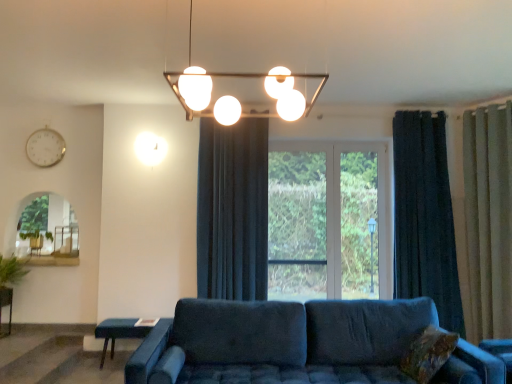
Question: From the image's perspective, is blue fabric table at lower left, the 2th table when ordered from left to right, positioned above or below beige fabric curtain at right, the third curtain when ordered from left to right?

Choices:
 (A) below
 (B) above

Answer: (A)

Question: Relative to beige fabric curtain at right, the third curtain when ordered from left to right, is blue fabric table at lower left, the 2th table when ordered from left to right, in front or behind?

Choices:
 (A) behind
 (B) front

Answer: (A)

Question: Which of these objects is positioned closest to the green leafy plant at left?

Choices:
 (A) dark blue velvet curtain at right, which is the 2th curtain from right to left
 (B) white metallic clock at upper left
 (C) dark blue velvet curtain at center, which appears as the 3th curtain when viewed from the right
 (D) metallic pendant light at upper center
 (E) brown textured pillow at lower right

Answer: (B)

Question: Which of these objects is positioned closest to the velvet blue couch at center?

Choices:
 (A) beige fabric curtain at right, the third curtain when ordered from left to right
 (B) white metallic clock at upper left
 (C) dark blue velvet curtain at right, which is counted as the 2th curtain, starting from the left
 (D) metallic pendant light at upper center
 (E) green leafy plant at left

Answer: (D)